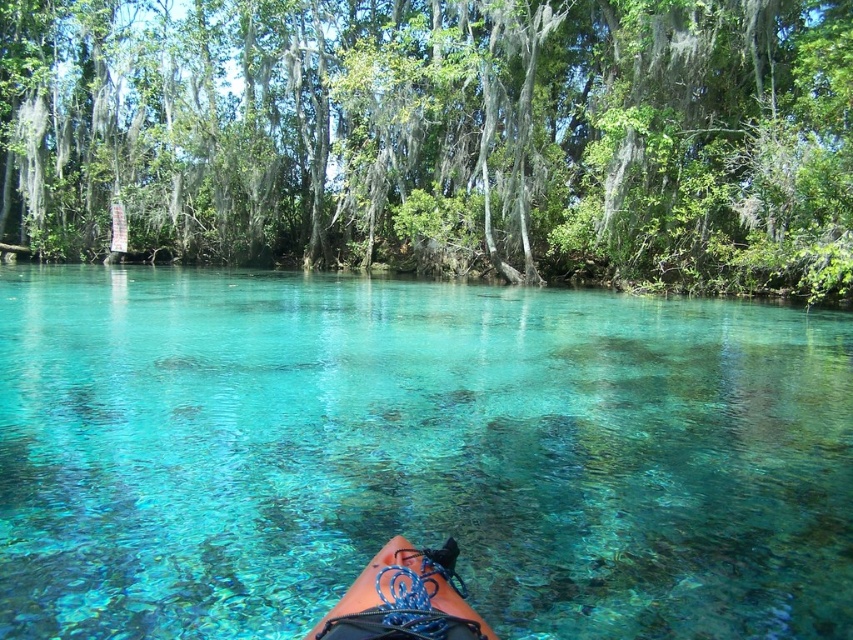
Can you confirm if green leafy tree at upper center is positioned below blue rubber canoe at lower center?

No.

Is green leafy tree at upper center smaller than blue rubber canoe at lower center?

No, green leafy tree at upper center is not smaller than blue rubber canoe at lower center.

Between point (155, 166) and point (346, 596), which one is positioned behind?

The point (155, 166) is more distant.

The width and height of the screenshot is (853, 640). In order to click on green leafy tree at upper center in this screenshot , I will do `click(438, 138)`.

From the picture: Does clear glassy water at center have a greater width compared to green leafy tree at upper center?

No, clear glassy water at center is not wider than green leafy tree at upper center.

Does clear glassy water at center appear on the left side of green leafy tree at upper center?

Incorrect, clear glassy water at center is not on the left side of green leafy tree at upper center.

Find the location of `clear glassy water at center`. clear glassy water at center is located at coordinates (416, 454).

Where is `clear glassy water at center`? Image resolution: width=853 pixels, height=640 pixels. clear glassy water at center is located at coordinates (416, 454).

Does clear glassy water at center have a smaller size compared to blue rubber canoe at lower center?

Incorrect, clear glassy water at center is not smaller in size than blue rubber canoe at lower center.

In the scene shown: Can you confirm if clear glassy water at center is shorter than blue rubber canoe at lower center?

Incorrect, clear glassy water at center's height does not fall short of blue rubber canoe at lower center's.

This screenshot has height=640, width=853. What are the coordinates of `clear glassy water at center` in the screenshot? It's located at (416, 454).

Where is `clear glassy water at center`? The width and height of the screenshot is (853, 640). clear glassy water at center is located at coordinates (416, 454).